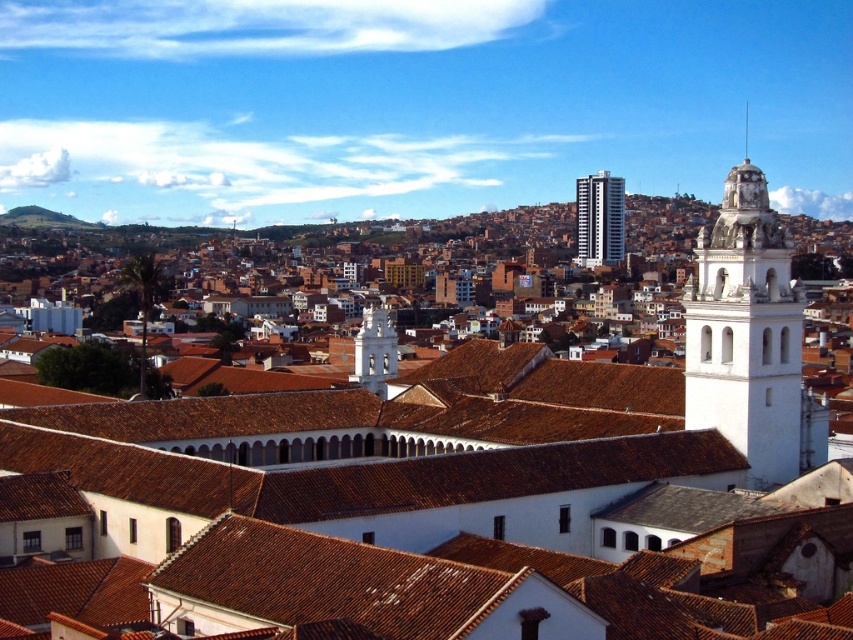
Question: Which point appears closest to the camera in this image?

Choices:
 (A) (747, 124)
 (B) (585, 259)
 (C) (740, 182)
 (D) (380, 320)

Answer: (C)

Question: Can you confirm if white smooth bell tower at upper right is thinner than white smooth spire at upper right?

Choices:
 (A) yes
 (B) no

Answer: (A)

Question: Is white stucco bell tower at center bigger than white smooth spire at upper right?

Choices:
 (A) no
 (B) yes

Answer: (A)

Question: Is white matte church tower at upper right smaller than white smooth spire at upper right?

Choices:
 (A) yes
 (B) no

Answer: (A)

Question: Which of these objects is positioned closest to the white matte church tower at upper right?

Choices:
 (A) white smooth bell tower at upper right
 (B) white stucco bell tower at upper right

Answer: (B)

Question: Which of the following is the closest to the observer?

Choices:
 (A) white smooth spire at upper right
 (B) white smooth bell tower at upper right
 (C) white matte church tower at upper right

Answer: (C)